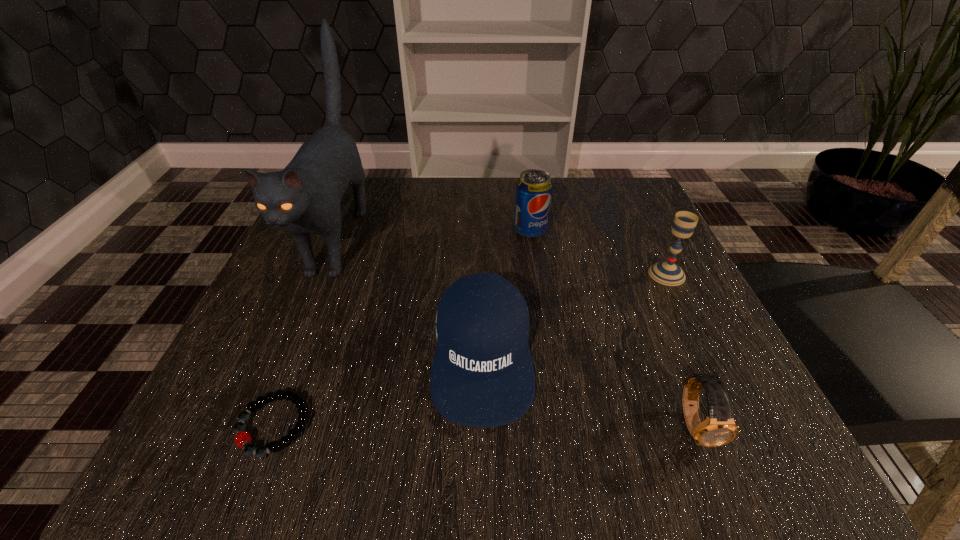
Find the location of a particular element. This screenshot has height=540, width=960. vacant position at the near right corner of the desktop is located at coordinates (753, 441).

Identify the location of blank region between the cat and the soda. The image size is (960, 540). (434, 235).

Find the location of a particular element. This screenshot has width=960, height=540. free space between the cat and the bracelet is located at coordinates (305, 332).

Identify the location of vacant region between the baseball cap and the tallest object. (410, 297).

The image size is (960, 540). I want to click on free spot between the chalice and the watch, so click(x=681, y=349).

This screenshot has height=540, width=960. What are the coordinates of `vacant space in between the tallest object and the third shortest object` in the screenshot? It's located at (410, 297).

Locate an element on the screen. vacant point located between the third shortest object and the tallest object is located at coordinates (410, 297).

Locate an element on the screen. The image size is (960, 540). free point between the fifth tallest object and the soda is located at coordinates (613, 328).

Choose which object is the second nearest neighbor to the rightmost object. Please provide its 2D coordinates. Your answer should be formatted as a tuple, i.e. [(x, y)], where the tuple contains the x and y coordinates of a point satisfying the conditions above.

[(719, 428)]

Identify which object is the second nearest to the shortest object. Please provide its 2D coordinates. Your answer should be formatted as a tuple, i.e. [(x, y)], where the tuple contains the x and y coordinates of a point satisfying the conditions above.

[(304, 198)]